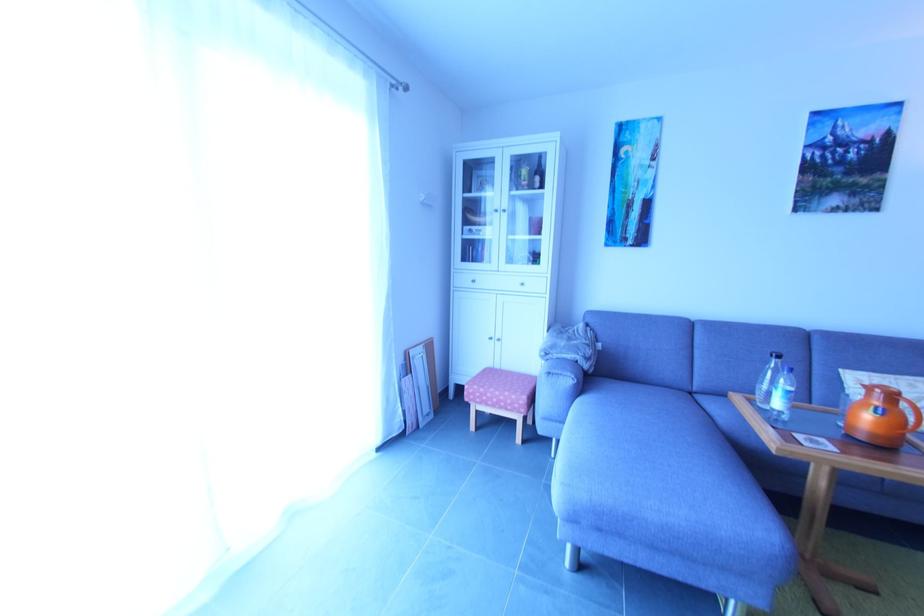
Where is `clear glass bottle`? This screenshot has height=616, width=924. clear glass bottle is located at coordinates (768, 379).